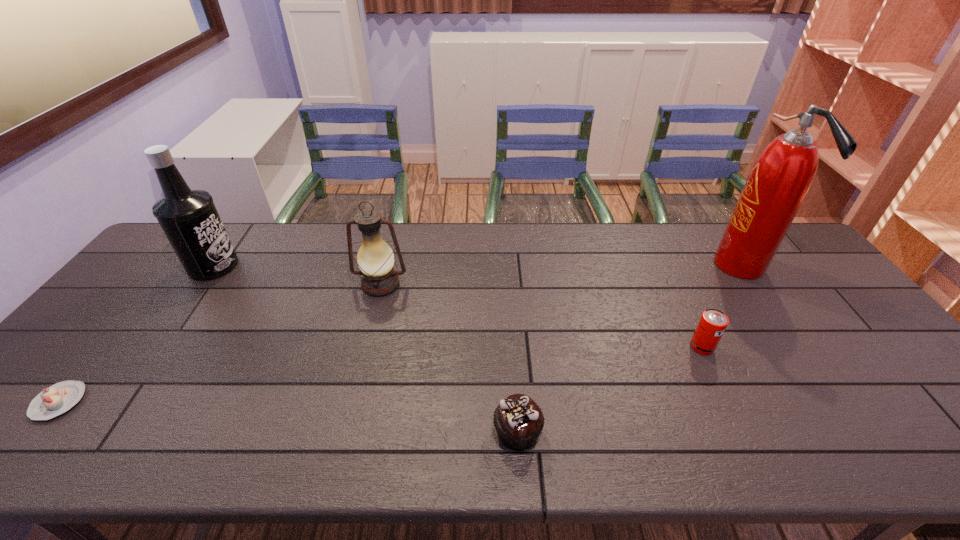
The image size is (960, 540). Find the location of `fire extinguisher`. fire extinguisher is located at coordinates (781, 177).

Locate an element on the screen. the tallest object is located at coordinates (781, 177).

Find the location of a particular element. This screenshot has width=960, height=540. the second tallest object is located at coordinates 188,217.

Where is `liquor`? liquor is located at coordinates (188, 217).

Where is `the third tallest object`? This screenshot has height=540, width=960. the third tallest object is located at coordinates (375, 258).

The width and height of the screenshot is (960, 540). Find the location of `the third object from left to right`. the third object from left to right is located at coordinates (375, 258).

Locate an element on the screen. The height and width of the screenshot is (540, 960). the second object from right to left is located at coordinates (712, 324).

Find the location of `the third nearest object`. the third nearest object is located at coordinates (712, 324).

Where is `the third object from right to left`? This screenshot has height=540, width=960. the third object from right to left is located at coordinates (518, 420).

At what (x,y) coordinates should I click in order to perform the action: click on the right cupcake. Please return your answer as a coordinate pair (x, y). This screenshot has height=540, width=960. Looking at the image, I should click on (518, 420).